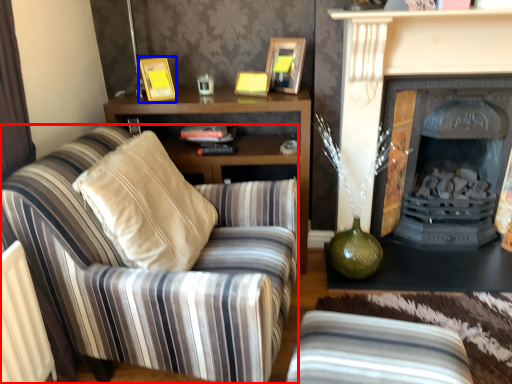
Question: Which object is closer to the camera taking this photo, chair (highlighted by a red box) or picture frame (highlighted by a blue box)?

Choices:
 (A) chair
 (B) picture frame

Answer: (A)